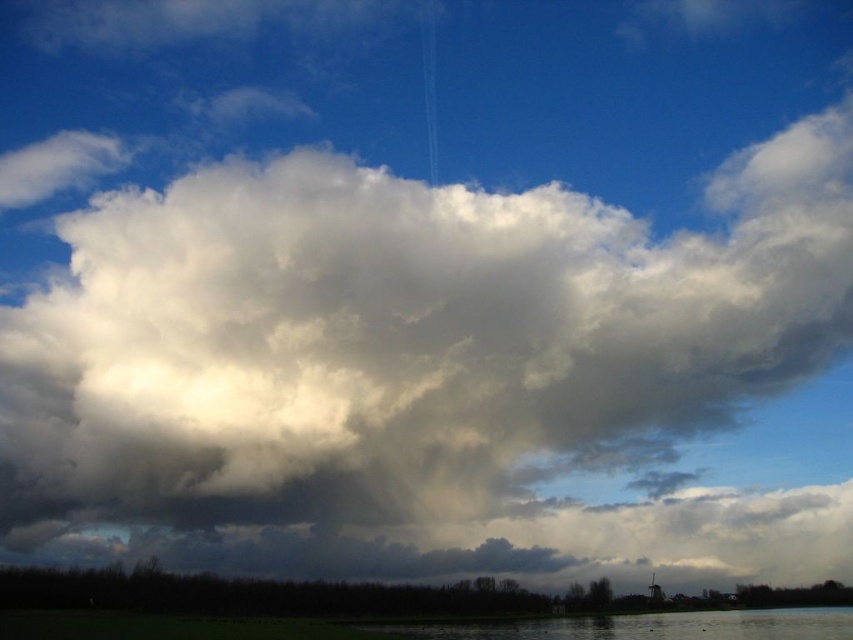
Does white fluffy cloud at center have a smaller size compared to smooth water at lower center?

No, white fluffy cloud at center is not smaller than smooth water at lower center.

Does white fluffy cloud at center appear over smooth water at lower center?

Indeed, white fluffy cloud at center is positioned over smooth water at lower center.

The image size is (853, 640). Identify the location of white fluffy cloud at center. (410, 349).